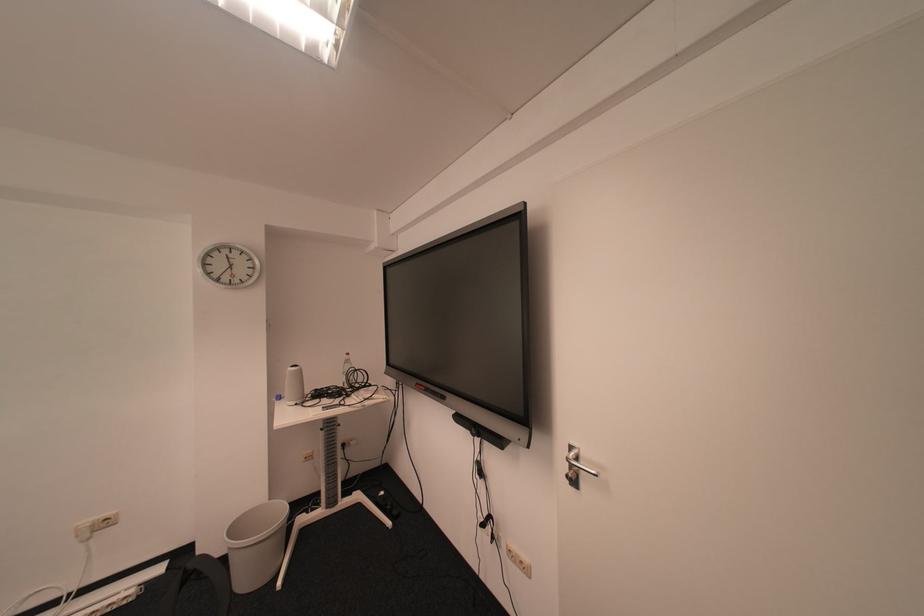
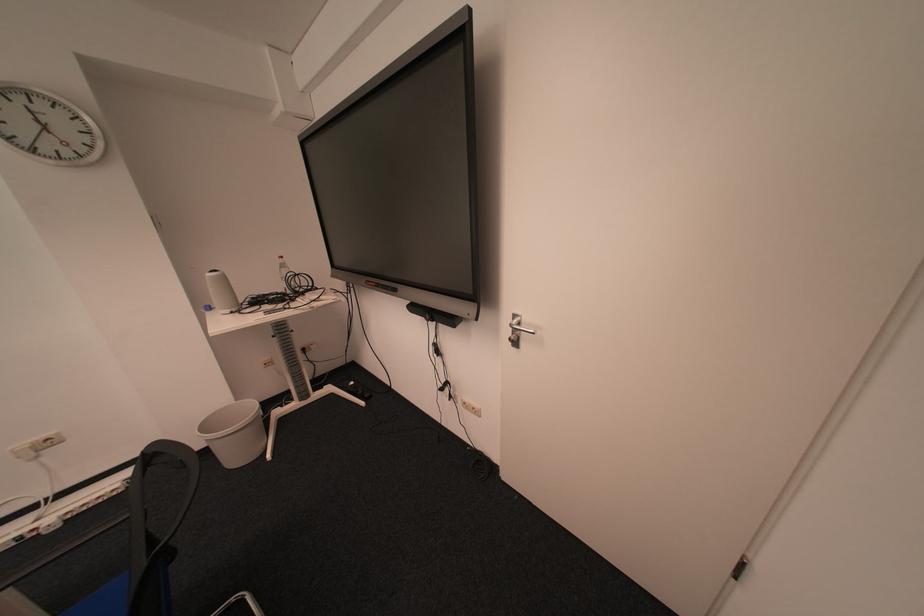
Find the pixel in the second image that matches [246,528] in the first image.

(216, 426)